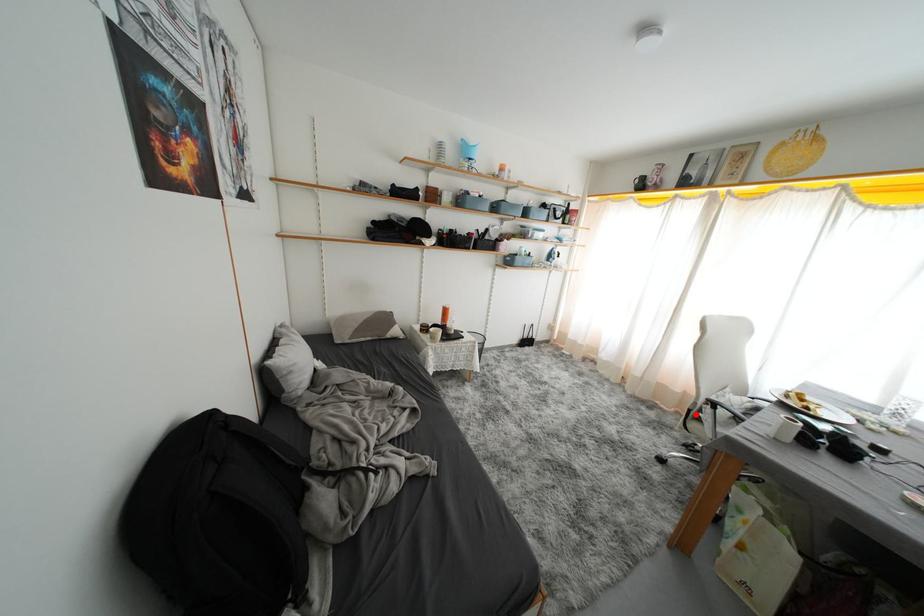
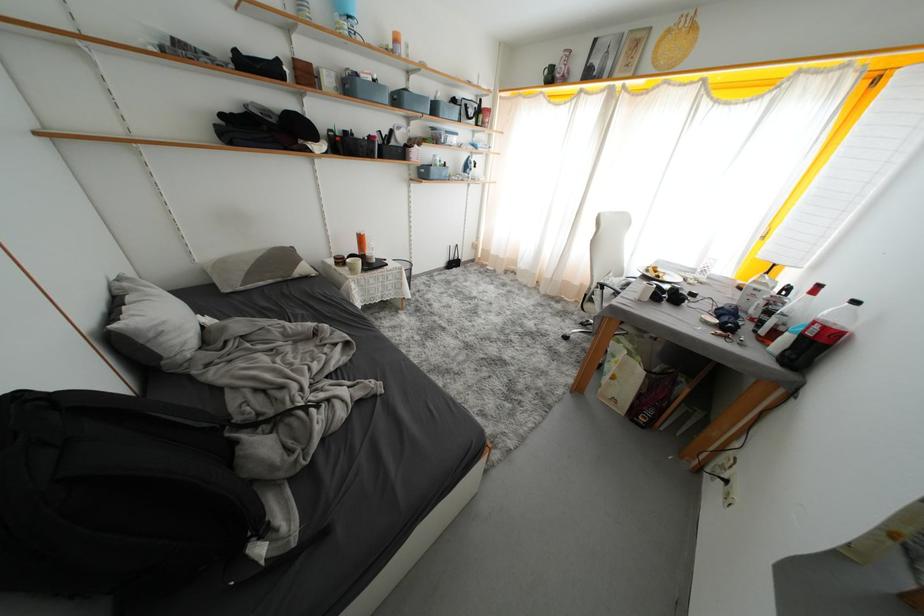
Find the pixel in the second image that matches the highlighted location in the first image.

(591, 299)